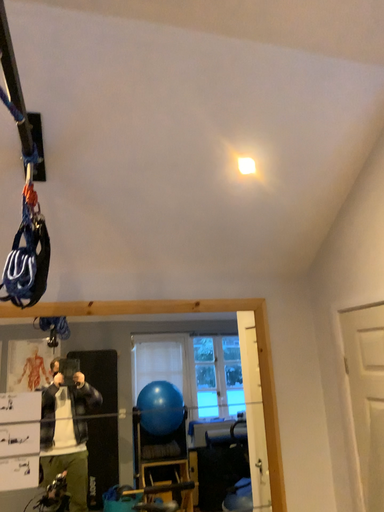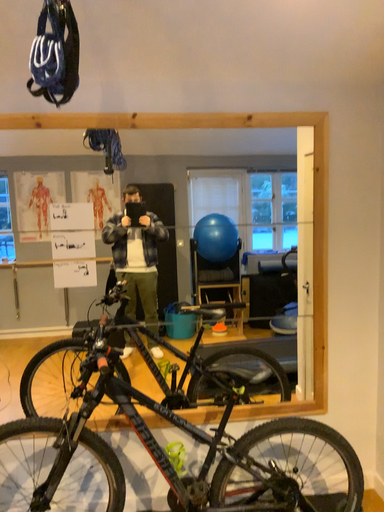
Question: Which way did the camera rotate in the video?

Choices:
 (A) rotated downward
 (B) rotated upward

Answer: (A)